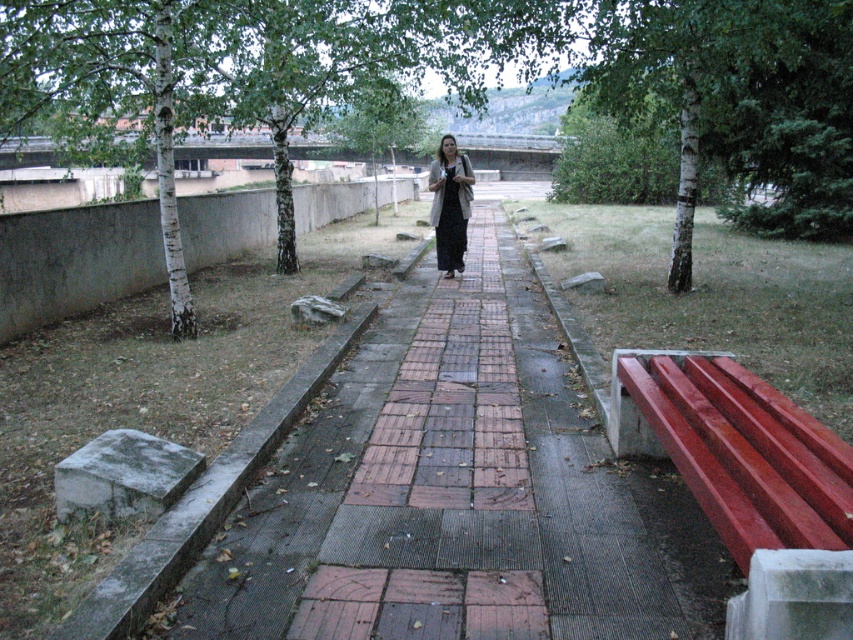
Is smooth red bench at right wider than dark gray fabric dress at center?

Yes, smooth red bench at right is wider than dark gray fabric dress at center.

Which is above, smooth red bench at right or dark gray fabric dress at center?

dark gray fabric dress at center is higher up.

Who is more forward, (735,484) or (444,252)?

Point (735,484)

This screenshot has width=853, height=640. In order to click on smooth red bench at right in this screenshot , I will do `click(746, 452)`.

Does brick paved walkway at center appear on the right side of smooth red bench at right?

In fact, brick paved walkway at center is to the left of smooth red bench at right.

Between brick paved walkway at center and smooth red bench at right, which one is positioned lower?

smooth red bench at right is below.

What do you see at coordinates (457, 492) in the screenshot? I see `brick paved walkway at center` at bounding box center [457, 492].

Where is `brick paved walkway at center`? Image resolution: width=853 pixels, height=640 pixels. brick paved walkway at center is located at coordinates (457, 492).

From the picture: Which is above, brick paved walkway at center or dark gray fabric dress at center?

dark gray fabric dress at center is above.

This screenshot has height=640, width=853. Identify the location of brick paved walkway at center. [x=457, y=492].

What are the coordinates of `brick paved walkway at center` in the screenshot? It's located at (457, 492).